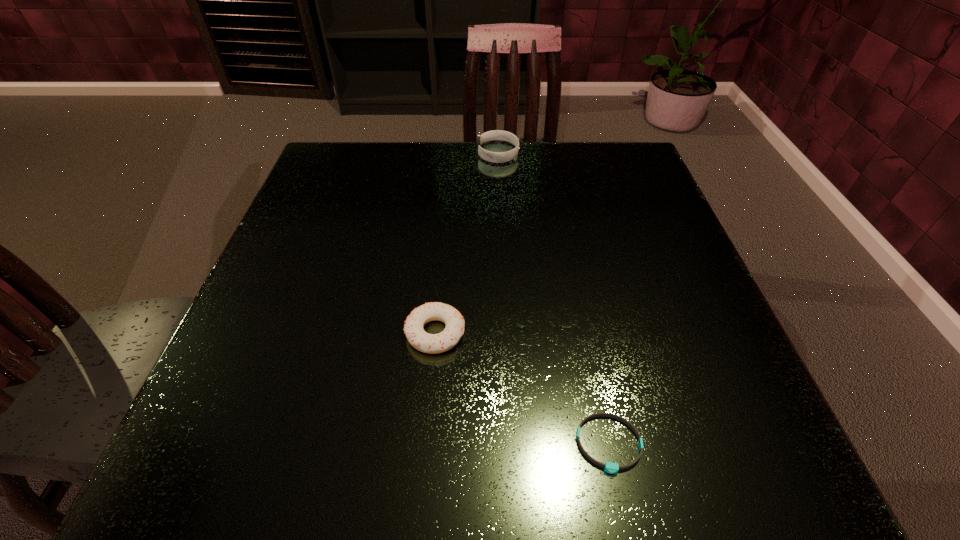
At what (x,y) coordinates should I click in order to perform the action: click on object that is the second closest to the farthest object. Please return your answer as a coordinate pair (x, y). Looking at the image, I should click on tap(609, 467).